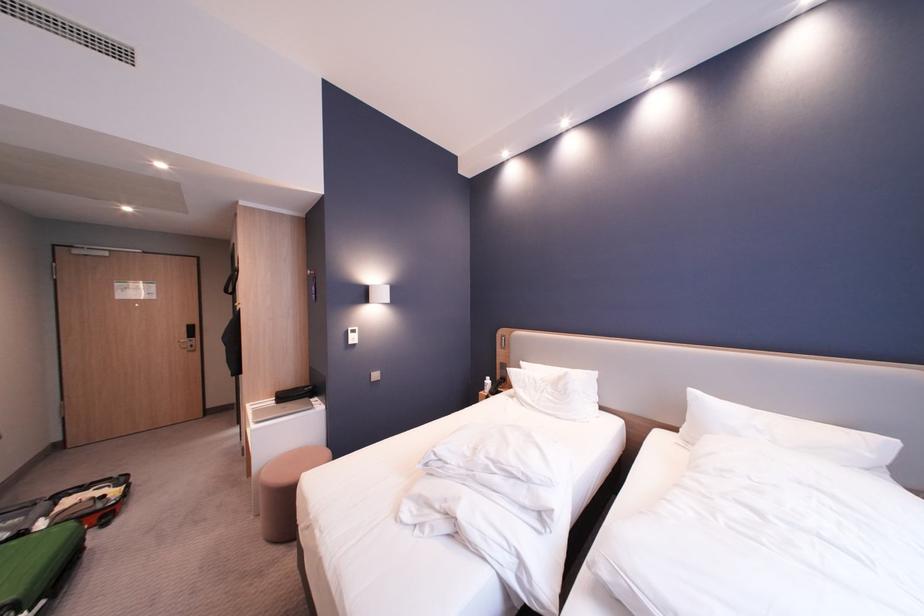
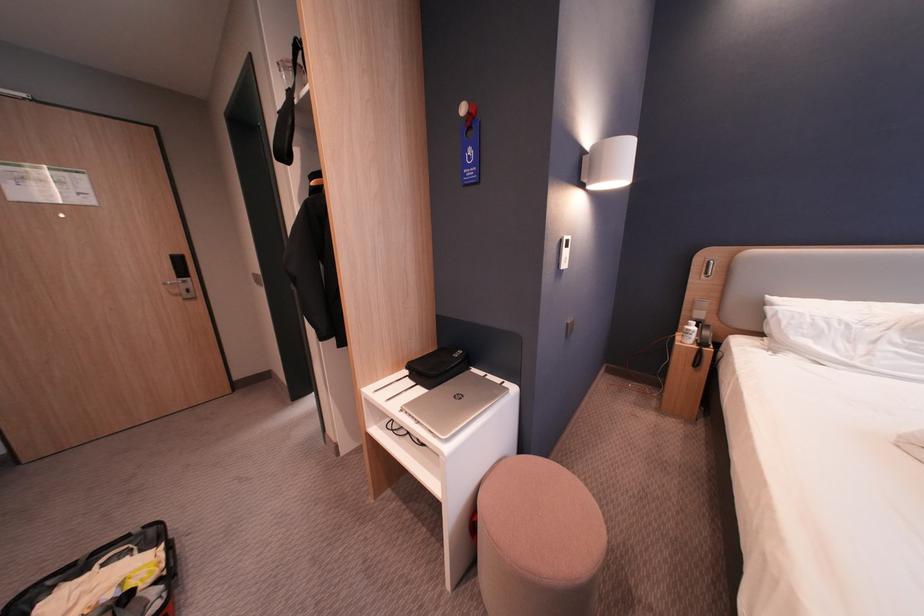
Where in the second image is the point corresponding to point 496,382 from the first image?

(698, 328)